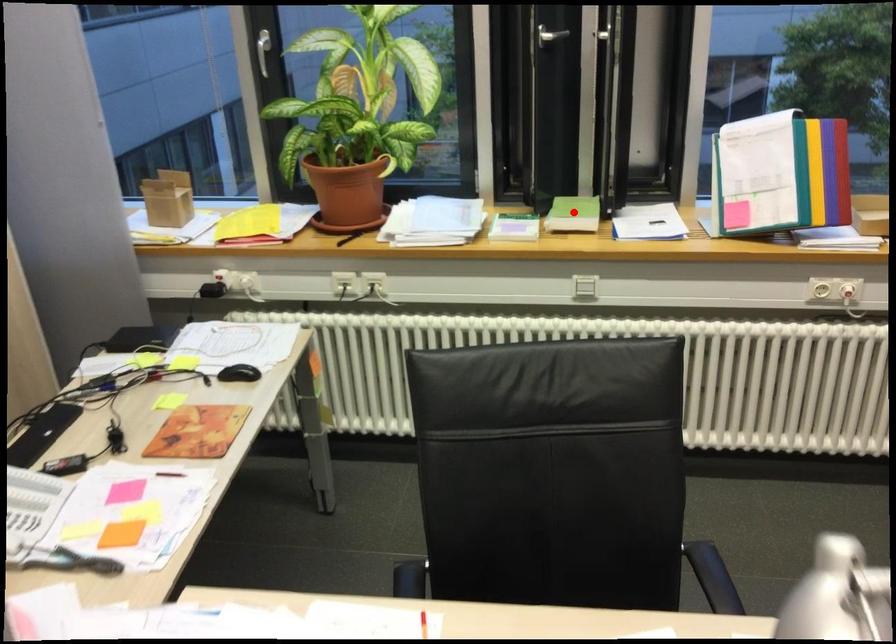
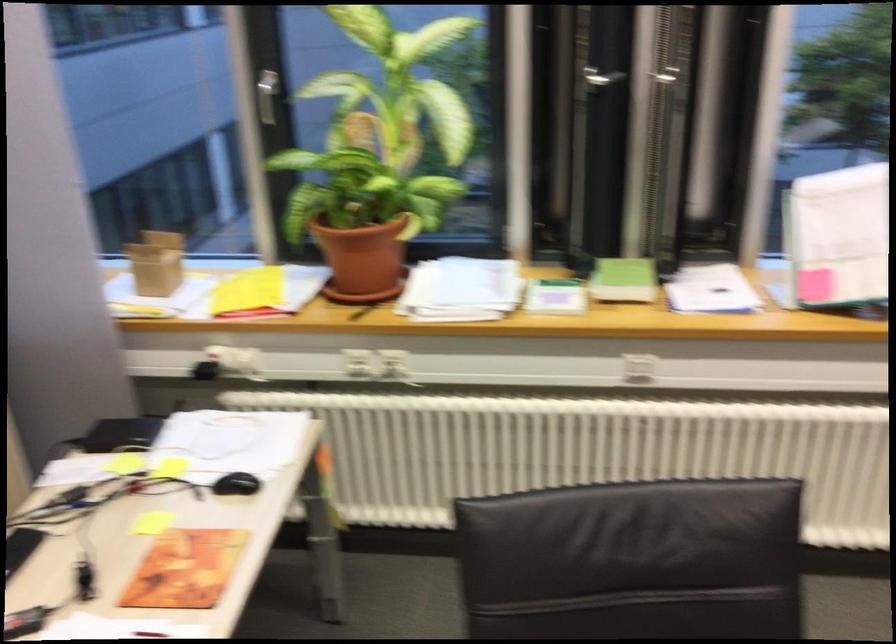
Find the pixel in the second image that matches the highlighted location in the first image.

(624, 279)